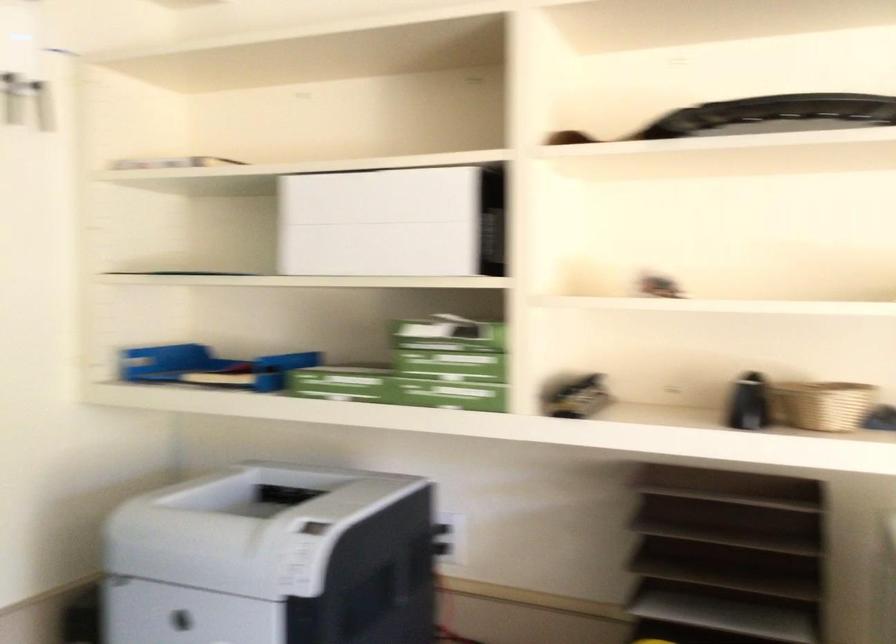
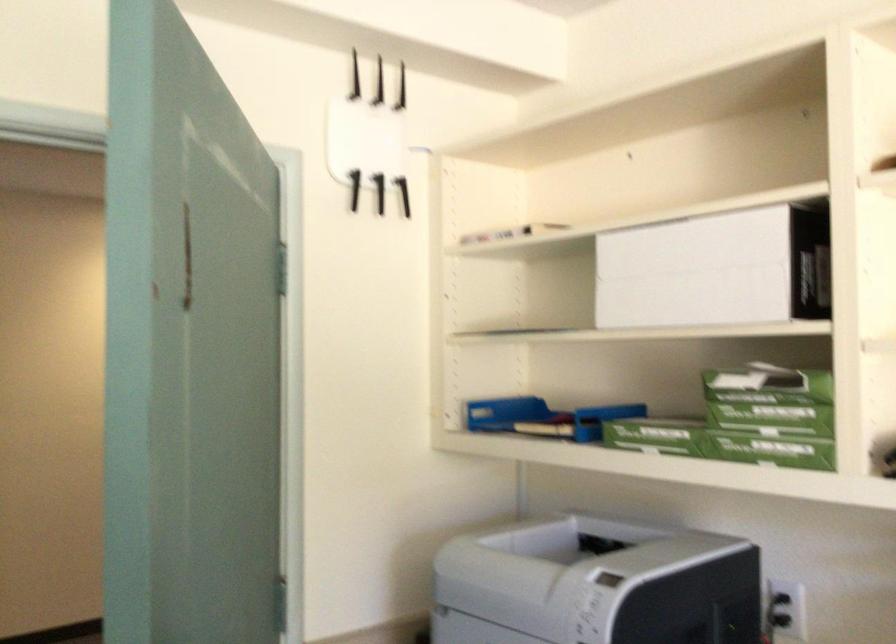
In the second image, find the point that corresponds to (209,363) in the first image.

(543, 418)